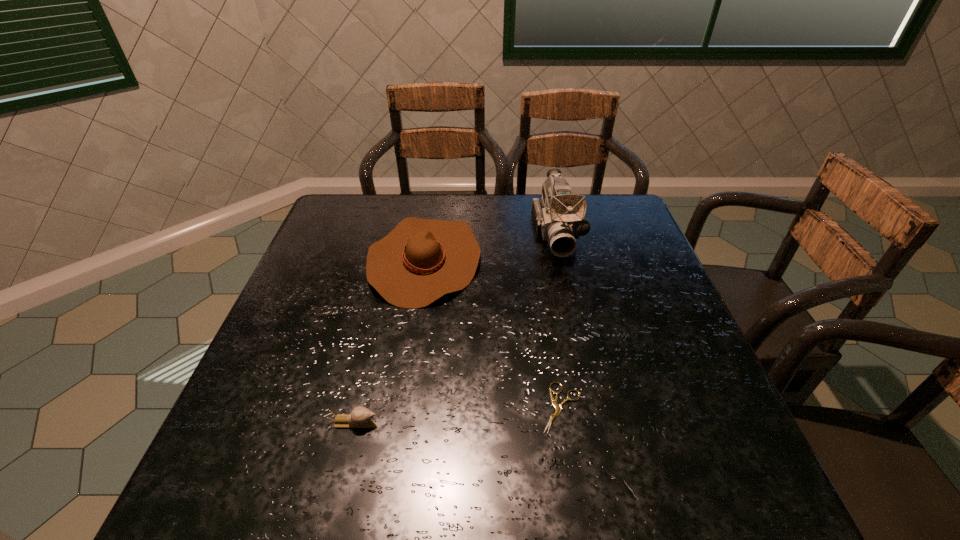
Where is `vacant space that's between the tallest object and the escargot`? The width and height of the screenshot is (960, 540). vacant space that's between the tallest object and the escargot is located at coordinates (455, 328).

Image resolution: width=960 pixels, height=540 pixels. I want to click on empty space between the shears and the tallest object, so click(559, 320).

Where is `vacant area between the third tallest object and the camcorder`? The width and height of the screenshot is (960, 540). vacant area between the third tallest object and the camcorder is located at coordinates (455, 328).

This screenshot has height=540, width=960. I want to click on free space between the camcorder and the shears, so click(x=559, y=320).

Where is `object that stands as the third closest to the camcorder`? object that stands as the third closest to the camcorder is located at coordinates (360, 417).

Point out which object is positioned as the nearest to the third shortest object. Please provide its 2D coordinates. Your answer should be formatted as a tuple, i.e. [(x, y)], where the tuple contains the x and y coordinates of a point satisfying the conditions above.

[(559, 218)]

The width and height of the screenshot is (960, 540). Find the location of `blank area in the image that satisfies the following two spatial constraints: 1. on the front-facing side of the tallest object; 2. on the shell of the escargot`. blank area in the image that satisfies the following two spatial constraints: 1. on the front-facing side of the tallest object; 2. on the shell of the escargot is located at coordinates (599, 423).